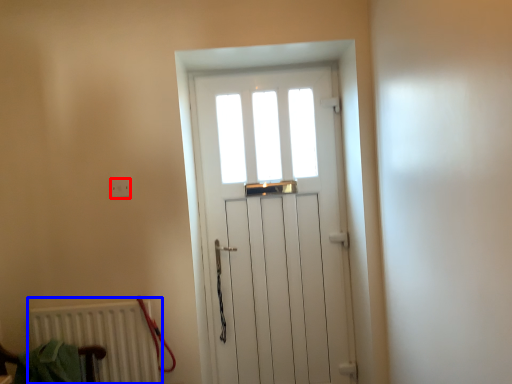
Question: Which object appears closest to the camera in this image, electric outlet (highlighted by a red box) or radiator (highlighted by a blue box)?

Choices:
 (A) electric outlet
 (B) radiator

Answer: (B)